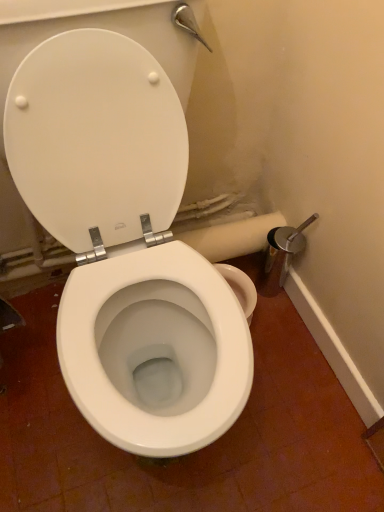
What do you see at coordinates (125, 244) in the screenshot? This screenshot has height=512, width=384. I see `white glossy toilet at center` at bounding box center [125, 244].

Identify the location of white glossy toilet at center. (125, 244).

From a real-world perspective, relative to white plastic toilet seat at center, is white glossy toilet at center vertically above or below?

In terms of real-world spatial position, white glossy toilet at center is above white plastic toilet seat at center.

Does white glossy toilet at center lie in front of white plastic toilet seat at center?

That is True.

From the picture: Do you think white glossy toilet at center is within white plastic toilet seat at center, or outside of it?

white glossy toilet at center exists outside the volume of white plastic toilet seat at center.

Considering the positions of points (82, 76) and (279, 222), is point (82, 76) closer to camera compared to point (279, 222)?

Yes.

Is white glossy toilet at center thinner than white matte toilet paper at center?

Incorrect, the width of white glossy toilet at center is not less than that of white matte toilet paper at center.

Which of these two, white glossy toilet at center or white matte toilet paper at center, is bigger?

Bigger between the two is white glossy toilet at center.

Could you tell me if white plastic toilet seat at center is turned towards white glossy toilet at center?

Yes, white plastic toilet seat at center is turned towards white glossy toilet at center.

Does white plastic toilet seat at center appear on the right side of white glossy toilet at center?

No, white plastic toilet seat at center is not to the right of white glossy toilet at center.

From a real-world perspective, relative to white glossy toilet at center, is white plastic toilet seat at center vertically above or below?

In terms of real-world spatial position, white plastic toilet seat at center is below white glossy toilet at center.

Considering the sizes of objects white plastic toilet seat at center and white glossy toilet at center in the image provided, who is bigger, white plastic toilet seat at center or white glossy toilet at center?

Bigger between the two is white glossy toilet at center.

What's the angular difference between white plastic toilet seat at center and white matte toilet paper at center's facing directions?

white plastic toilet seat at center and white matte toilet paper at center are facing 0.0968 degrees away from each other.

From a real-world perspective, is white plastic toilet seat at center positioned over white matte toilet paper at center based on gravity?

Correct, in the physical world, white plastic toilet seat at center is higher than white matte toilet paper at center.

Considering the sizes of objects white plastic toilet seat at center and white matte toilet paper at center in the image provided, who is bigger, white plastic toilet seat at center or white matte toilet paper at center?

With larger size is white plastic toilet seat at center.

Does white matte toilet paper at center have a greater height compared to white glossy toilet at center?

No, white matte toilet paper at center is not taller than white glossy toilet at center.

The width and height of the screenshot is (384, 512). Find the location of `toilet in front of the white matte toilet paper at center`. toilet in front of the white matte toilet paper at center is located at coordinates (125, 244).

Based on the photo, is white glossy toilet at center completely or partially inside white matte toilet paper at center?

That's incorrect, white glossy toilet at center is not inside white matte toilet paper at center.

Is white matte toilet paper at center positioned far away from white glossy toilet at center?

No, white matte toilet paper at center is not far from white glossy toilet at center.

Measure the distance between white matte toilet paper at center and white plastic toilet seat at center.

white matte toilet paper at center is 16.24 inches away from white plastic toilet seat at center.

Does white matte toilet paper at center lie in front of white plastic toilet seat at center?

No, white matte toilet paper at center is behind white plastic toilet seat at center.

Which point is more forward, (x=245, y=238) or (x=59, y=224)?

The point (x=59, y=224) is closer to the camera.

Can you confirm if white matte toilet paper at center is shorter than white plastic toilet seat at center?

Correct, white matte toilet paper at center is not as tall as white plastic toilet seat at center.

What are the coordinates of `the back above the white glossy toilet at center (from the image's perspective)` in the screenshot? It's located at (96, 138).

Where is `toilet paper on the right of white glossy toilet at center`? toilet paper on the right of white glossy toilet at center is located at coordinates (232, 237).

From the image, which object appears to be farther from white glossy toilet at center, white matte toilet paper at center or white plastic toilet seat at center?

Among the two, white matte toilet paper at center is located further to white glossy toilet at center.

Considering their positions, is white plastic toilet seat at center positioned further to white glossy toilet at center than white matte toilet paper at center?

Based on the image, white matte toilet paper at center appears to be further to white glossy toilet at center.

Looking at the image, which one is located further to white plastic toilet seat at center, white matte toilet paper at center or white glossy toilet at center?

The object further to white plastic toilet seat at center is white matte toilet paper at center.

Based on their spatial positions, is white glossy toilet at center or white matte toilet paper at center closer to white plastic toilet seat at center?

white glossy toilet at center.

Which object lies further to the anchor point white matte toilet paper at center, white glossy toilet at center or white plastic toilet seat at center?

The object further to white matte toilet paper at center is white plastic toilet seat at center.

Estimate the real-world distances between objects in this image. Which object is further from white matte toilet paper at center, white plastic toilet seat at center or white glossy toilet at center?

Among the two, white plastic toilet seat at center is located further to white matte toilet paper at center.

In order to click on the back located between white glossy toilet at center and white matte toilet paper at center in the depth direction in this screenshot , I will do `click(96, 138)`.